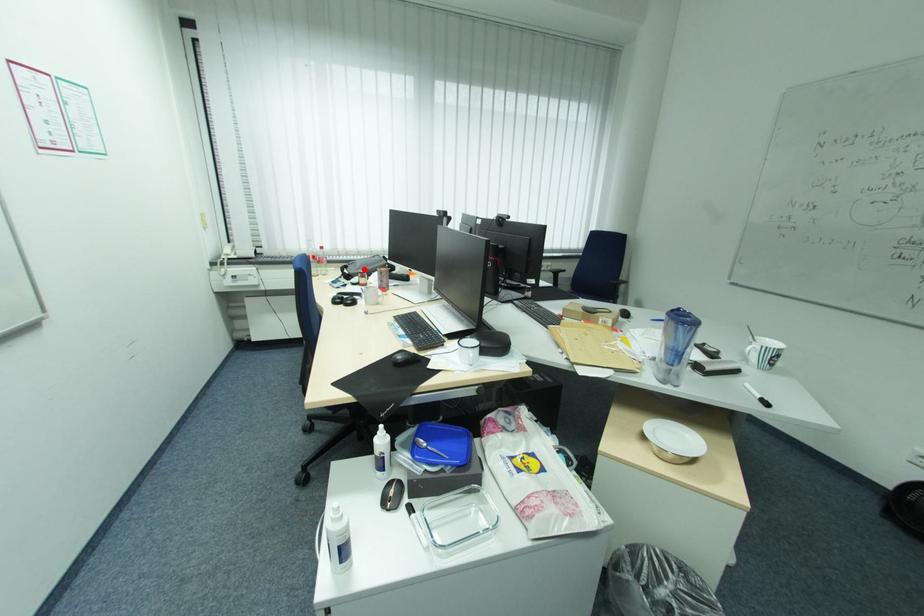
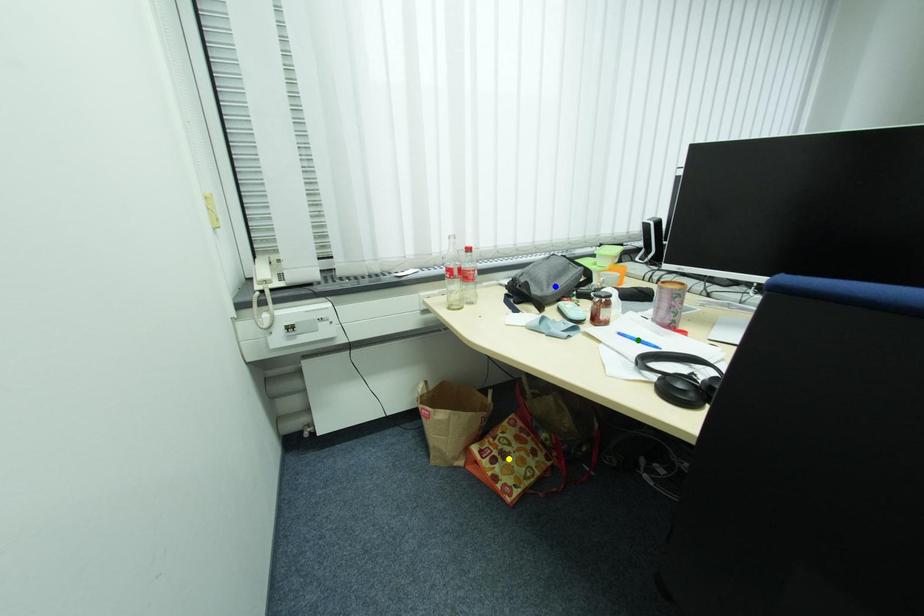
Question: I am providing you with two images of the same scene from different viewpoints. A red point is marked on the first image. You are given multiple points on the second image. Can you choose the point in image 2 that corresponds to the point in image 1?

Choices:
 (A) blue point
 (B) yellow point
 (C) green point

Answer: (A)